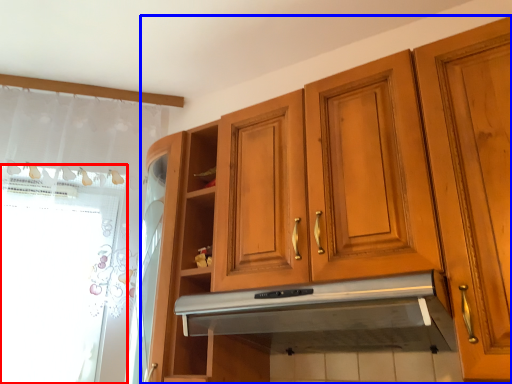
Question: Which object is further to the camera taking this photo, window screen (highlighted by a red box) or cabinetry (highlighted by a blue box)?

Choices:
 (A) window screen
 (B) cabinetry

Answer: (A)